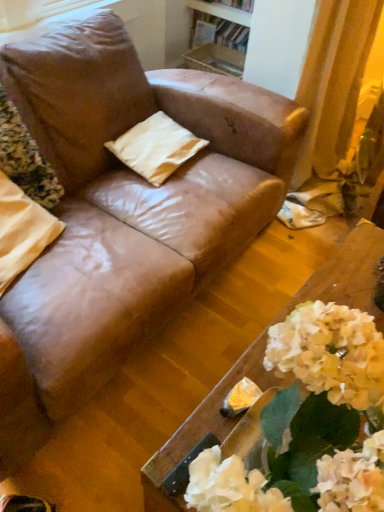
Question: From the image's perspective, is wooden table at lower right located above or below beige fabric pillow at center, the 2th pillow viewed from the front?

Choices:
 (A) below
 (B) above

Answer: (A)

Question: Is wooden table at lower right wider or thinner than beige fabric pillow at center, which is the first pillow from right to left?

Choices:
 (A) wide
 (B) thin

Answer: (A)

Question: Estimate the real-world distances between objects in this image. Which object is farther from the beige fabric pillow at center, placed as the first pillow when sorted from back to front?

Choices:
 (A) wooden bookshelf at upper center
 (B) wooden table at lower right
 (C) matte brown pillow at upper left
 (D) beige fabric pillow at left, positioned as the 1th pillow in front-to-back order

Answer: (A)

Question: Estimate the real-world distances between objects in this image. Which object is closer to the wooden bookshelf at upper center?

Choices:
 (A) matte brown pillow at upper left
 (B) beige fabric pillow at left, the first pillow in the left-to-right sequence
 (C) beige fabric pillow at center, the second pillow when ordered from left to right
 (D) wooden table at lower right

Answer: (C)